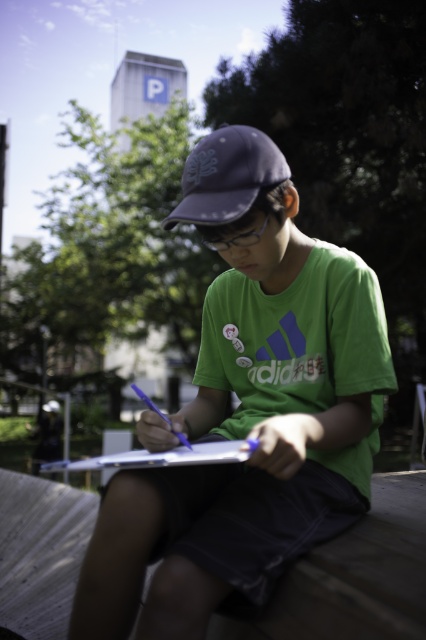
Does point (210, 612) lie in front of point (218, 140)?

Yes.

Between green matte shirt at center and matte blue baseball cap at center, which one has more height?

With more height is green matte shirt at center.

At what (x,y) coordinates should I click in order to perform the action: click on green matte shirt at center. Please return your answer as a coordinate pair (x, y). Looking at the image, I should click on (247, 410).

This screenshot has height=640, width=426. In order to click on green matte shirt at center in this screenshot , I will do `click(247, 410)`.

Is green matte shirt at center positioned before white paper at center?

No, green matte shirt at center is behind white paper at center.

Is green matte shirt at center thinner than white paper at center?

Yes, green matte shirt at center is thinner than white paper at center.

Looking at this image, who is more forward, (339, 381) or (224, 445)?

Point (224, 445)

Image resolution: width=426 pixels, height=640 pixels. I want to click on green matte shirt at center, so click(247, 410).

In the scene shown: Does matte blue baseball cap at center appear over white paper at center?

Yes, matte blue baseball cap at center is above white paper at center.

Who is more forward, (204, 189) or (198, 454)?

Positioned in front is point (198, 454).

In order to click on matte blue baseball cap at center in this screenshot , I will do `click(227, 176)`.